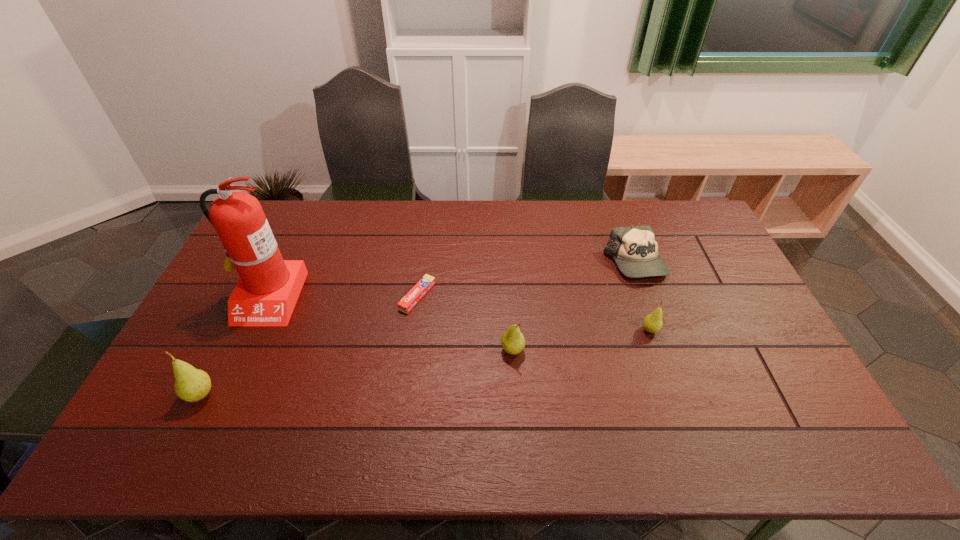
The width and height of the screenshot is (960, 540). I want to click on free space that satisfies the following two spatial constraints: 1. on the front-facing side of the fire extinguisher; 2. on the right side of the second shortest pear, so click(242, 350).

Find the location of a particular element. vacant space that satisfies the following two spatial constraints: 1. on the front-facing side of the shortest pear; 2. on the right side of the fire extinguisher is located at coordinates (252, 330).

Where is `free spot that satisfies the following two spatial constraints: 1. on the back side of the second nearest pear; 2. on the right side of the shortest pear`? Image resolution: width=960 pixels, height=540 pixels. free spot that satisfies the following two spatial constraints: 1. on the back side of the second nearest pear; 2. on the right side of the shortest pear is located at coordinates (511, 330).